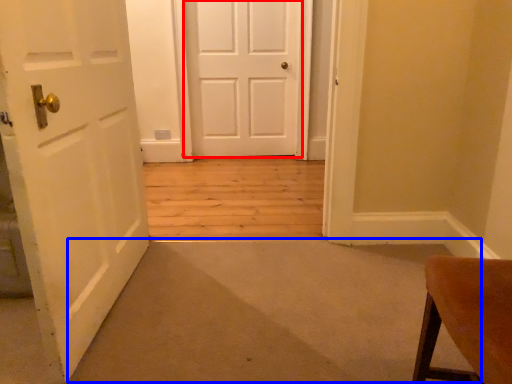
Question: Which of the following is the farthest to the observer, door (highlighted by a red box) or door (highlighted by a blue box)?

Choices:
 (A) door
 (B) door

Answer: (A)